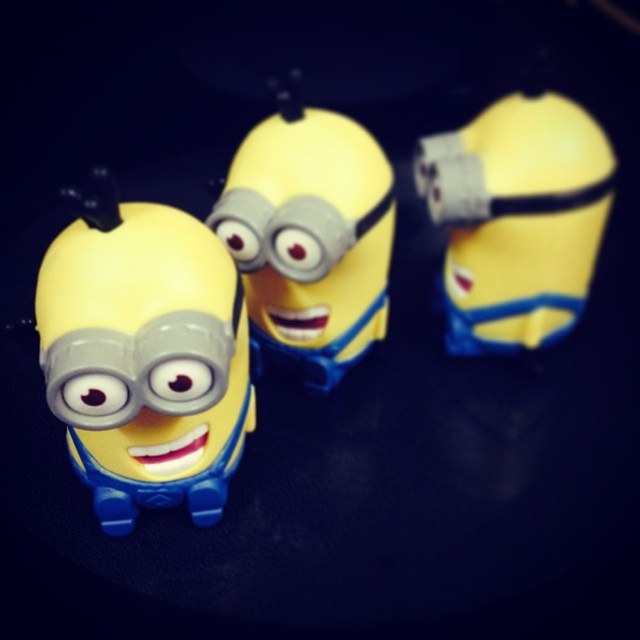
From the picture: You are a photographer trying to capture a closeup of the Minion figurines. You notice two specific points in the image labeled as point 1 at coordinates point (193, 364) and point 2 at coordinates point (508, 109). Which of these two points should you focus on to ensure the closest Minion figurine is in sharp focus?

Point (193, 364) is closer to the camera than point (508, 109), so focusing on point (193, 364) will ensure the closest Minion figurine is in sharp focus.

You are a photographer taking a picture of the Minion figurines. You notice two points in the scene at coordinates point (529, 310) and point (252, 252). Which point is closer to your camera?

Point (252, 252) is closer to the camera because it is less further than point (529, 310).

You are a collector who wants to display the matte plastic minion at left and the yellow matte toy at upper right on a shelf. If you want to arrange them so that the one closer to the front is the one that appears closer in the image, which one should you place in front?

The matte plastic minion at left should be placed in front because it is closer to the viewer in the image than the yellow matte toy at upper right.